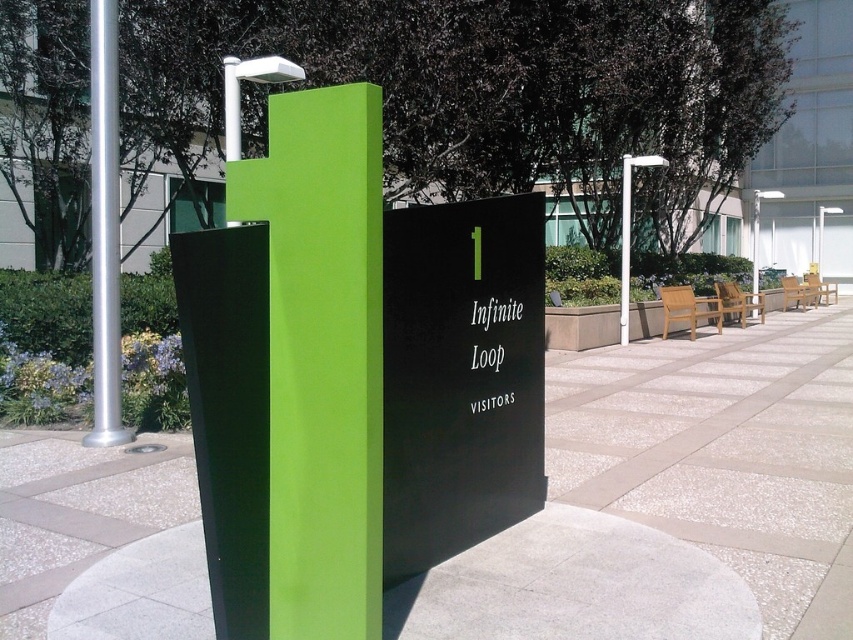
Question: Is lime green matte pillar at center further to camera compared to white plastic pole at center?

Choices:
 (A) yes
 (B) no

Answer: (B)

Question: Among these points, which one is farthest from the camera?

Choices:
 (A) (111, 173)
 (B) (630, 220)

Answer: (B)

Question: Can you confirm if lime green matte pillar at center is smaller than silver metallic pole at left?

Choices:
 (A) yes
 (B) no

Answer: (A)

Question: Which object is closer to the camera taking this photo?

Choices:
 (A) lime green matte pillar at center
 (B) silver metallic pole at left

Answer: (A)

Question: Among these objects, which one is nearest to the camera?

Choices:
 (A) white plastic pole at center
 (B) silver metallic pole at left
 (C) lime green matte pillar at center

Answer: (C)

Question: Does lime green matte pillar at center appear on the right side of silver metallic pole at left?

Choices:
 (A) yes
 (B) no

Answer: (A)